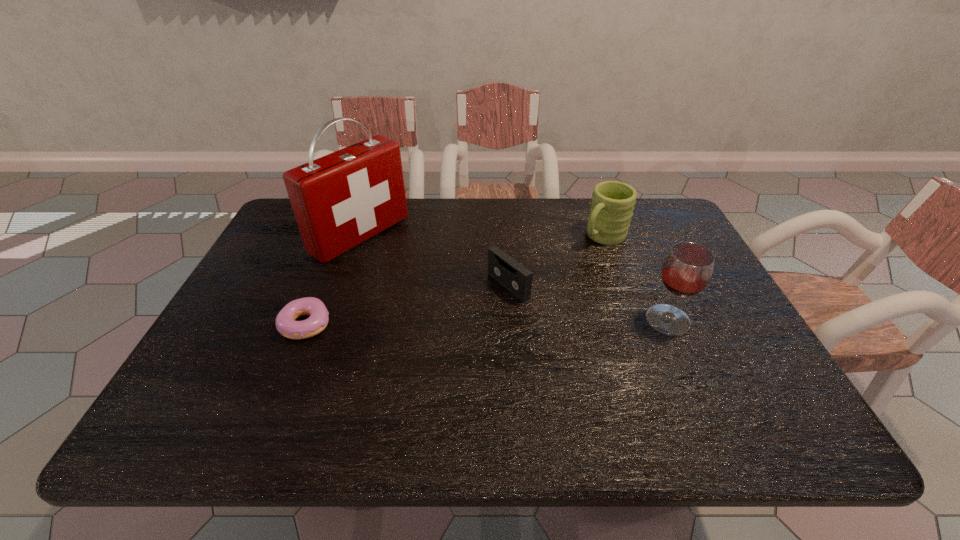
This screenshot has width=960, height=540. What are the coordinates of `the first-aid kit that is at the left edge` in the screenshot? It's located at (340, 200).

Locate an element on the screen. object present at the right edge is located at coordinates (686, 271).

Where is `object located at the far left corner`? The height and width of the screenshot is (540, 960). object located at the far left corner is located at coordinates (340, 200).

Locate an element on the screen. The height and width of the screenshot is (540, 960). free spot at the far edge of the desktop is located at coordinates (517, 228).

This screenshot has width=960, height=540. Find the location of `vacant space at the left edge of the desktop`. vacant space at the left edge of the desktop is located at coordinates (269, 279).

Locate an element on the screen. Image resolution: width=960 pixels, height=540 pixels. vacant area at the right edge of the desktop is located at coordinates (666, 291).

In the image, there is a desktop. Identify the location of vacant area at the far left corner. (279, 226).

Find the location of a particular element. blank space at the far right corner of the desktop is located at coordinates (636, 226).

The height and width of the screenshot is (540, 960). In order to click on empty space that is in between the fourth tallest object and the third shortest object in this screenshot , I will do [556, 261].

I want to click on free spot between the fourth shortest object and the doughnut, so click(487, 322).